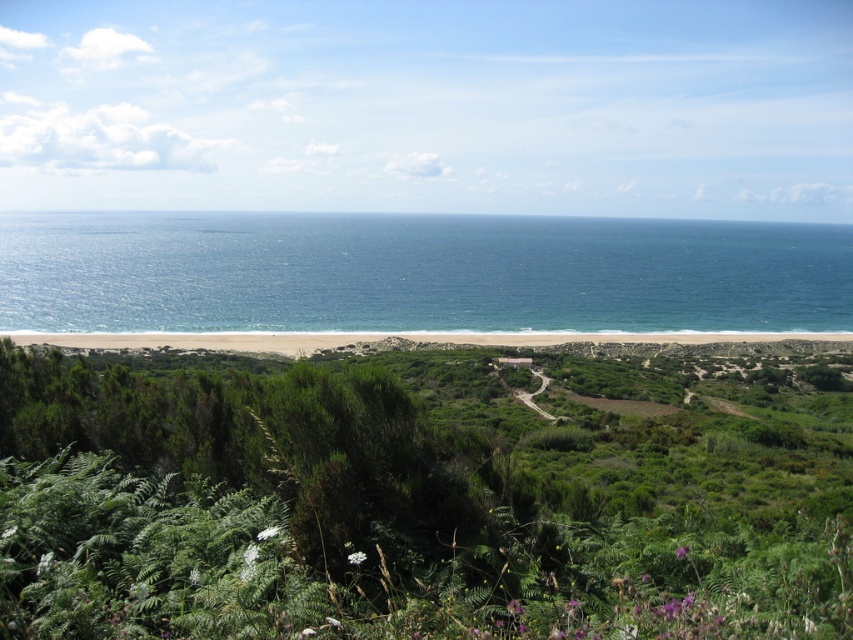
Question: Is green leafy shrubs at center below blue water at center?

Choices:
 (A) no
 (B) yes

Answer: (B)

Question: Is green leafy shrubs at center further to the viewer compared to blue water at center?

Choices:
 (A) no
 (B) yes

Answer: (A)

Question: Estimate the real-world distances between objects in this image. Which object is farther from the green leafy shrubs at center?

Choices:
 (A) blue water at center
 (B) white sand beach at lower center

Answer: (A)

Question: Estimate the real-world distances between objects in this image. Which object is closer to the green leafy shrubs at center?

Choices:
 (A) white sand beach at lower center
 (B) blue water at center

Answer: (A)

Question: Can you confirm if green leafy shrubs at center is thinner than blue water at center?

Choices:
 (A) yes
 (B) no

Answer: (A)

Question: Which point is closer to the camera taking this photo?

Choices:
 (A) (747, 332)
 (B) (720, 600)

Answer: (B)